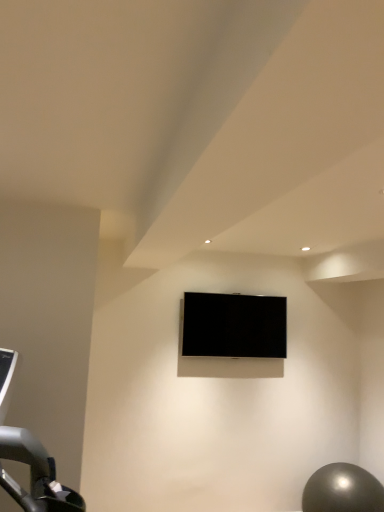
Question: Considering the relative positions of black glossy tv at center and metallic gray ball at lower right in the image provided, is black glossy tv at center to the left of metallic gray ball at lower right from the viewer's perspective?

Choices:
 (A) yes
 (B) no

Answer: (A)

Question: Is black glossy tv at center wider than metallic gray ball at lower right?

Choices:
 (A) no
 (B) yes

Answer: (A)

Question: Can we say black glossy tv at center lies outside metallic gray ball at lower right?

Choices:
 (A) yes
 (B) no

Answer: (A)

Question: From the image's perspective, is black glossy tv at center located beneath metallic gray ball at lower right?

Choices:
 (A) yes
 (B) no

Answer: (B)

Question: Is black glossy tv at center turned away from metallic gray ball at lower right?

Choices:
 (A) yes
 (B) no

Answer: (B)

Question: Considering the relative sizes of black glossy tv at center and metallic gray ball at lower right in the image provided, is black glossy tv at center bigger than metallic gray ball at lower right?

Choices:
 (A) yes
 (B) no

Answer: (B)

Question: Does metallic gray ball at lower right come in front of black glossy tv at center?

Choices:
 (A) no
 (B) yes

Answer: (B)

Question: Considering the relative sizes of metallic gray ball at lower right and black glossy tv at center in the image provided, is metallic gray ball at lower right bigger than black glossy tv at center?

Choices:
 (A) no
 (B) yes

Answer: (B)

Question: Is metallic gray ball at lower right positioned behind black glossy tv at center?

Choices:
 (A) yes
 (B) no

Answer: (B)

Question: Is the surface of metallic gray ball at lower right in direct contact with black glossy tv at center?

Choices:
 (A) no
 (B) yes

Answer: (A)

Question: Does metallic gray ball at lower right appear on the left side of black glossy tv at center?

Choices:
 (A) no
 (B) yes

Answer: (A)

Question: Is there a large distance between metallic gray ball at lower right and black glossy tv at center?

Choices:
 (A) no
 (B) yes

Answer: (B)

Question: Is black glossy tv at center spatially inside metallic gray ball at lower right, or outside of it?

Choices:
 (A) inside
 (B) outside

Answer: (B)